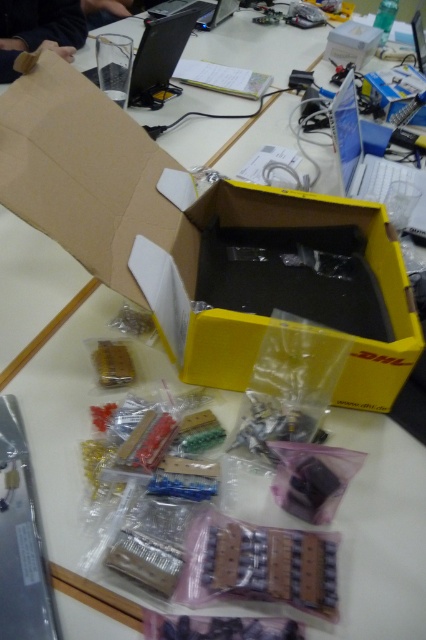
Between silver metallic laptop at upper right and glossy black laptop at upper center, which one is positioned higher?

Positioned higher is glossy black laptop at upper center.

From the picture: Does silver metallic laptop at upper right have a larger size compared to glossy black laptop at upper center?

No, silver metallic laptop at upper right is not bigger than glossy black laptop at upper center.

Describe the element at coordinates (370, 156) in the screenshot. I see `silver metallic laptop at upper right` at that location.

Locate an element on the screen. Image resolution: width=426 pixels, height=640 pixels. silver metallic laptop at upper right is located at coordinates (370, 156).

Which is more to the left, silver metallic laptop at upper right or black plastic laptop at upper center?

black plastic laptop at upper center is more to the left.

Does silver metallic laptop at upper right have a greater width compared to black plastic laptop at upper center?

No.

Is point (423, 188) less distant than point (97, 77)?

Yes.

At what (x,y) coordinates should I click in order to perform the action: click on silver metallic laptop at upper right. Please return your answer as a coordinate pair (x, y). Looking at the image, I should click on (370, 156).

Looking at this image, is yellow cardboard box at center thinner than yellow matte box at center?

No, yellow cardboard box at center is not thinner than yellow matte box at center.

Locate an element on the screen. yellow cardboard box at center is located at coordinates (201, 241).

In order to click on yellow cardboard box at center in this screenshot , I will do `click(201, 241)`.